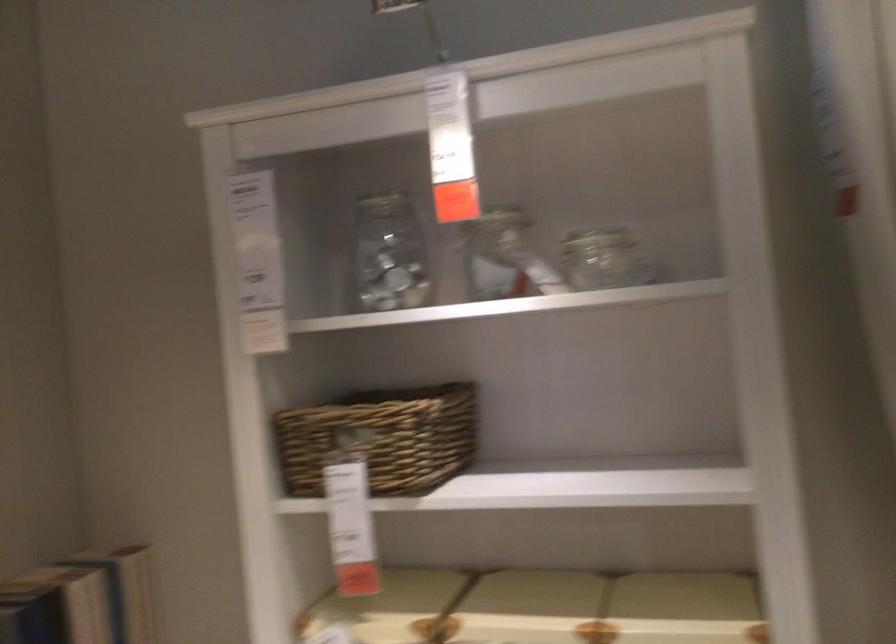
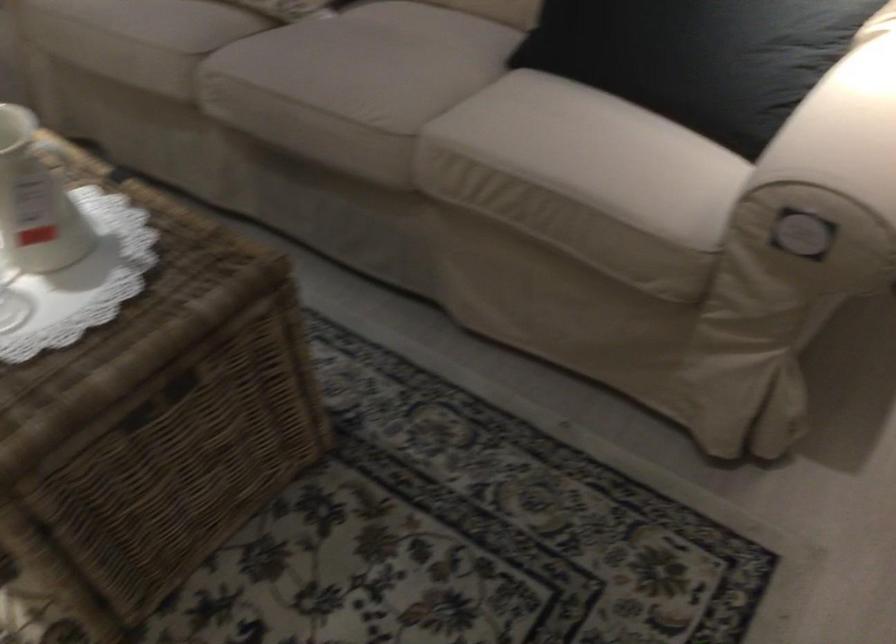
First-person continuous shooting, in which direction is the camera rotating?

The camera's rotation is toward left-down.